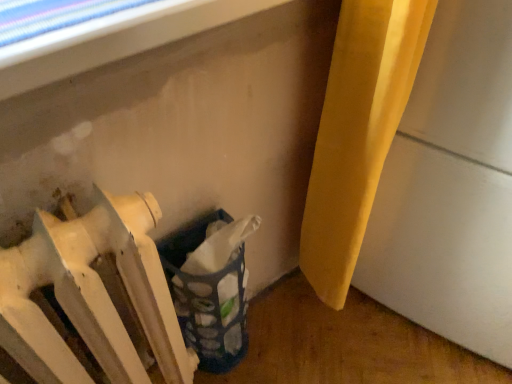
Question: Is blue fabric laundry basket at lower center positioned with its back to white matte radiator at lower left?

Choices:
 (A) no
 (B) yes

Answer: (A)

Question: Does blue fabric laundry basket at lower center have a lesser width compared to white matte radiator at lower left?

Choices:
 (A) no
 (B) yes

Answer: (B)

Question: Is blue fabric laundry basket at lower center positioned behind white matte radiator at lower left?

Choices:
 (A) yes
 (B) no

Answer: (A)

Question: Does blue fabric laundry basket at lower center have a greater height compared to white matte radiator at lower left?

Choices:
 (A) yes
 (B) no

Answer: (B)

Question: Considering the relative positions of blue fabric laundry basket at lower center and white matte radiator at lower left in the image provided, is blue fabric laundry basket at lower center to the left of white matte radiator at lower left from the viewer's perspective?

Choices:
 (A) no
 (B) yes

Answer: (A)

Question: Considering the relative sizes of blue fabric laundry basket at lower center and white matte radiator at lower left in the image provided, is blue fabric laundry basket at lower center bigger than white matte radiator at lower left?

Choices:
 (A) yes
 (B) no

Answer: (B)

Question: Is white matte radiator at lower left aimed at blue fabric laundry basket at lower center?

Choices:
 (A) no
 (B) yes

Answer: (A)

Question: Does white matte radiator at lower left appear on the right side of blue fabric laundry basket at lower center?

Choices:
 (A) yes
 (B) no

Answer: (B)

Question: From the image's perspective, would you say white matte radiator at lower left is shown under blue fabric laundry basket at lower center?

Choices:
 (A) no
 (B) yes

Answer: (B)

Question: Is white matte radiator at lower left thinner than blue fabric laundry basket at lower center?

Choices:
 (A) no
 (B) yes

Answer: (A)

Question: Considering the relative sizes of white matte radiator at lower left and blue fabric laundry basket at lower center in the image provided, is white matte radiator at lower left shorter than blue fabric laundry basket at lower center?

Choices:
 (A) yes
 (B) no

Answer: (B)

Question: Is white matte radiator at lower left looking in the opposite direction of blue fabric laundry basket at lower center?

Choices:
 (A) no
 (B) yes

Answer: (A)

Question: Is point (x=166, y=314) closer or farther from the camera than point (x=212, y=309)?

Choices:
 (A) farther
 (B) closer

Answer: (B)